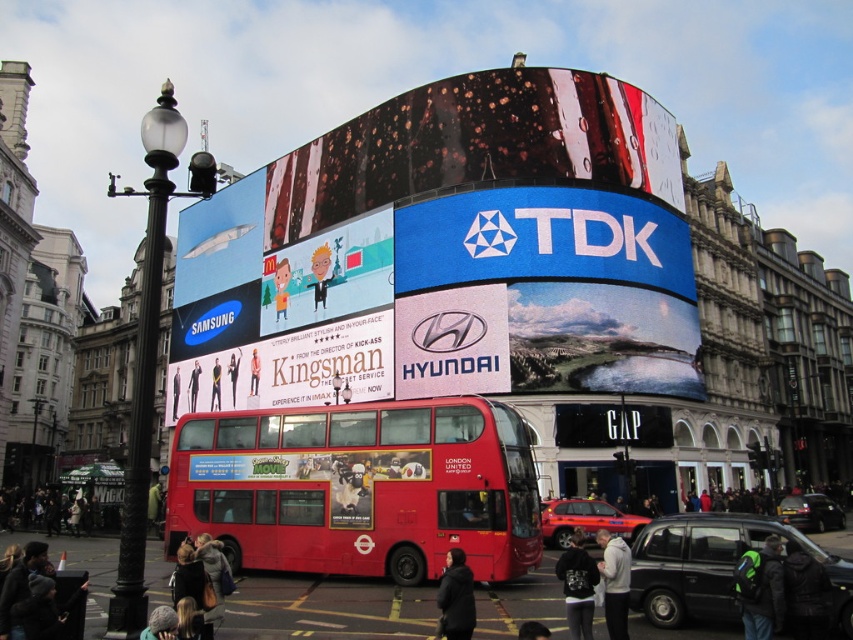
Which is above, green backpack at center or light gray hoodie at center?

green backpack at center

Between green backpack at center and light gray hoodie at center, which one has less height?

green backpack at center is shorter.

Between point (757, 621) and point (612, 589), which one is positioned in front?

Point (757, 621) is more forward.

At what (x,y) coordinates should I click in order to perform the action: click on green backpack at center. Please return your answer as a coordinate pair (x, y). The image size is (853, 640). Looking at the image, I should click on (759, 589).

Who is taller, matte red bus at center or dark gray jacket at lower left?

matte red bus at center is taller.

Does matte red bus at center appear under dark gray jacket at lower left?

Incorrect, matte red bus at center is not positioned below dark gray jacket at lower left.

This screenshot has height=640, width=853. In order to click on matte red bus at center in this screenshot , I will do `click(322, 476)`.

Is point (289, 454) closer to camera compared to point (456, 556)?

No.

Consider the image. Does matte red bus at center have a greater height compared to black fabric jacket at lower center?

Yes.

Is point (297, 516) positioned in front of point (444, 612)?

No, it is behind (444, 612).

Where is `matte red bus at center`? The width and height of the screenshot is (853, 640). matte red bus at center is located at coordinates (322, 476).